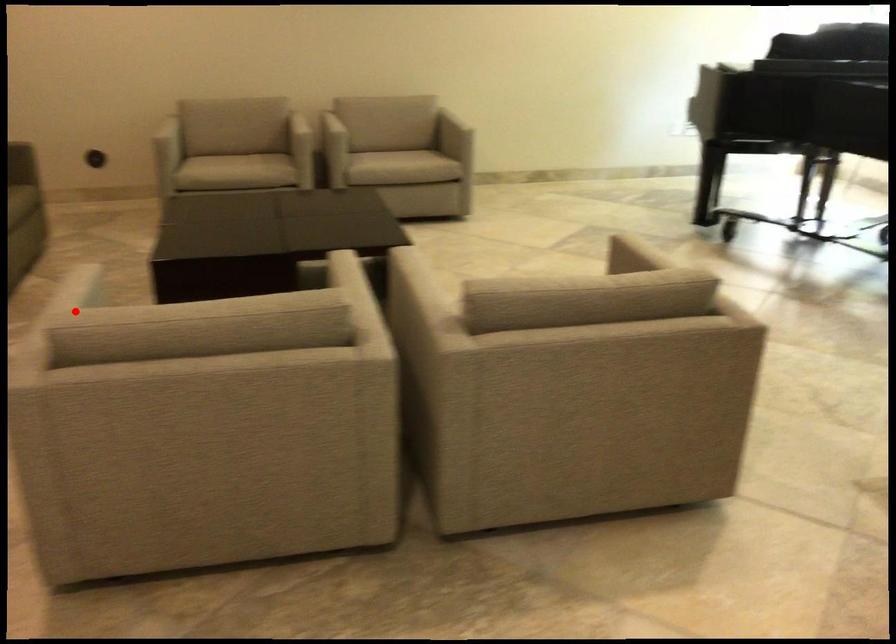
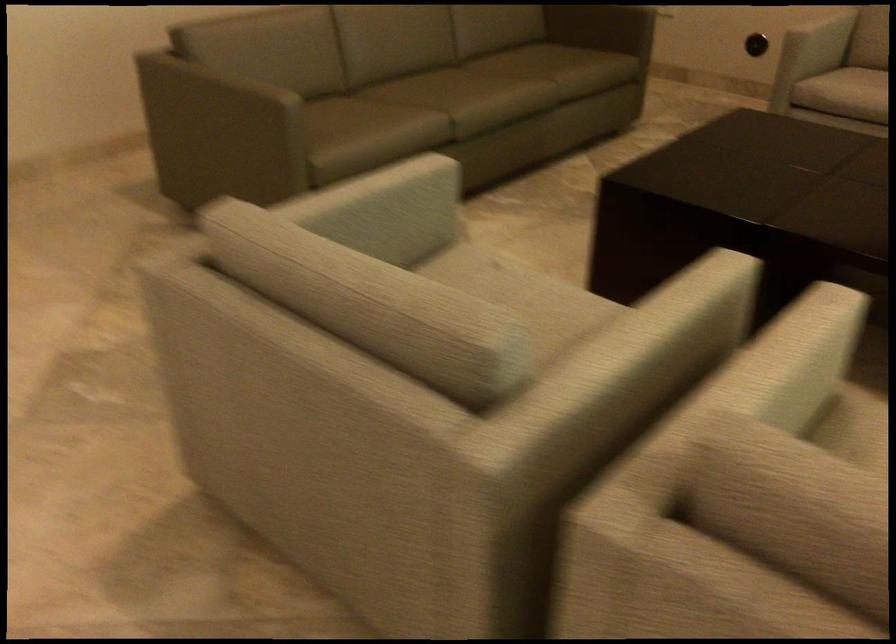
Question: I am providing you with two images of the same scene from different viewpoints. Given a red point in image1, look at the same physical point in image2. Is it:

Choices:
 (A) Closer to the viewpoint
 (B) Farther from the viewpoint

Answer: (A)